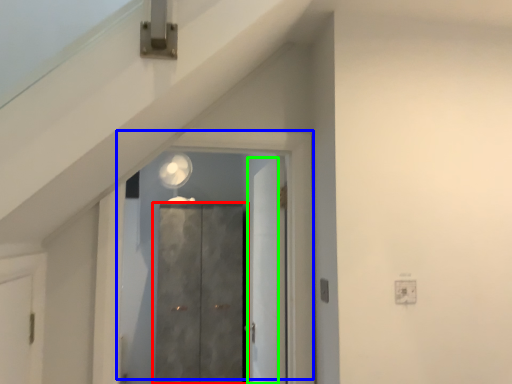
Question: Estimate the real-world distances between objects in this image. Which object is closer to door (highlighted by a red box), door (highlighted by a blue box) or door (highlighted by a green box)?

Choices:
 (A) door
 (B) door

Answer: (B)